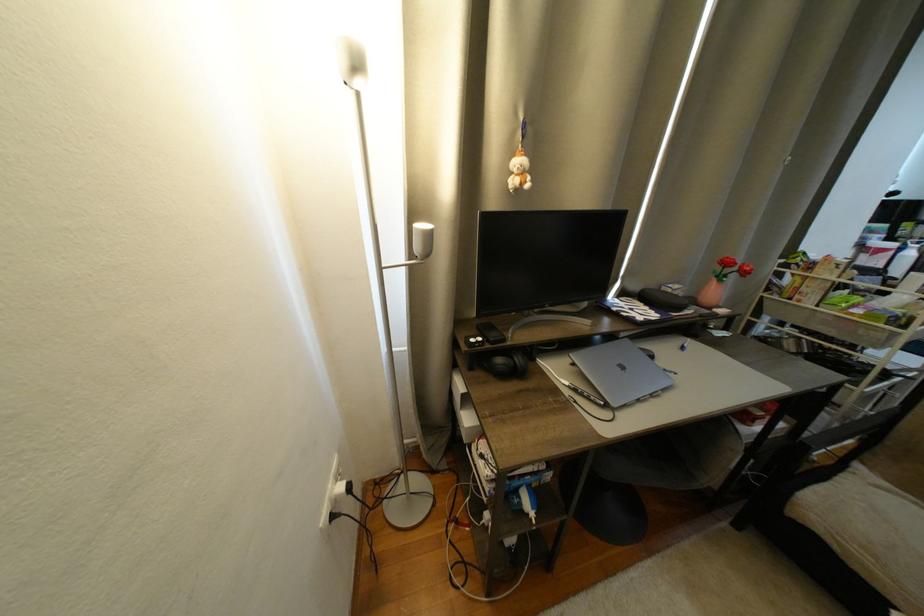
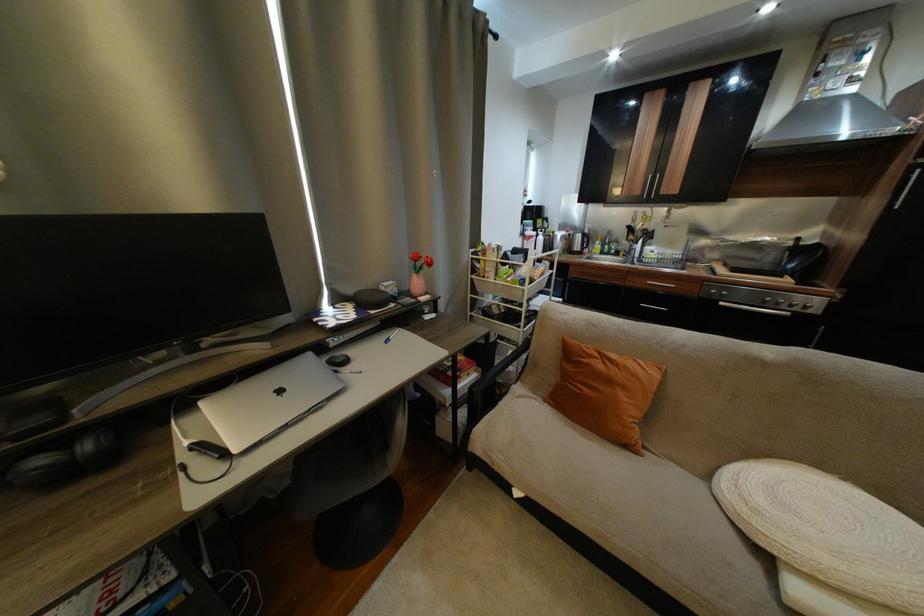
Question: Based on the continuous images, in which direction is the camera rotating? Reply with the corresponding letter.

Choices:
 (A) Left
 (B) Right
 (C) Up
 (D) Down

Answer: (B)